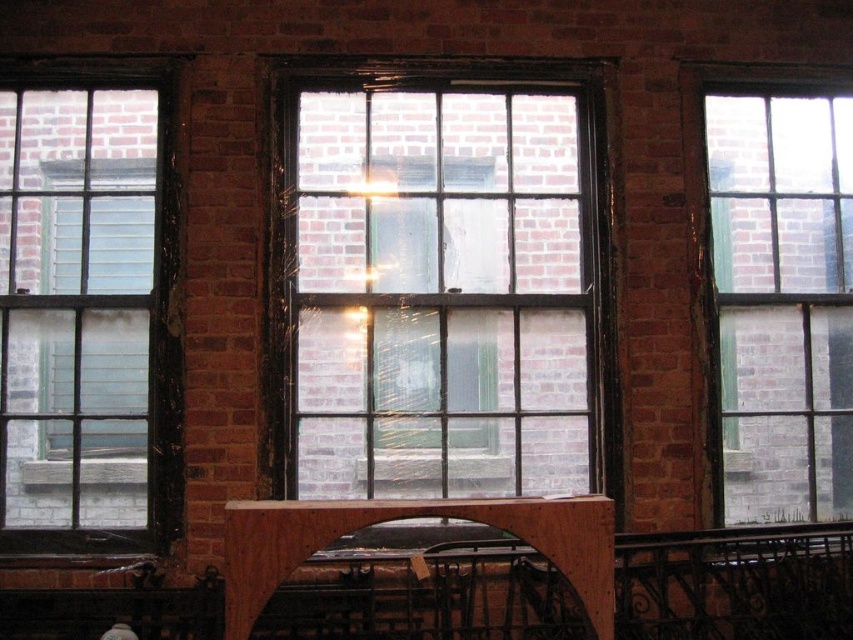
Question: Which point appears farthest from the camera in this image?

Choices:
 (A) (287, 113)
 (B) (27, 188)

Answer: (A)

Question: Where is clear glass window at left located in relation to wooden at center in the image?

Choices:
 (A) right
 (B) left

Answer: (B)

Question: Which of the following is the farthest from the observer?

Choices:
 (A) brown wooden rail at center
 (B) clear glass window at left

Answer: (B)

Question: Which point appears farthest from the camera in this image?

Choices:
 (A) pos(811,534)
 (B) pos(105,509)
 (C) pos(741,296)
 (D) pos(376,132)

Answer: (C)

Question: From the image, what is the correct spatial relationship of clear glass window at upper right in relation to wooden at center?

Choices:
 (A) right
 (B) left

Answer: (A)

Question: Where is clear glass window at left located in relation to brown wooden rail at center in the image?

Choices:
 (A) right
 (B) left

Answer: (B)